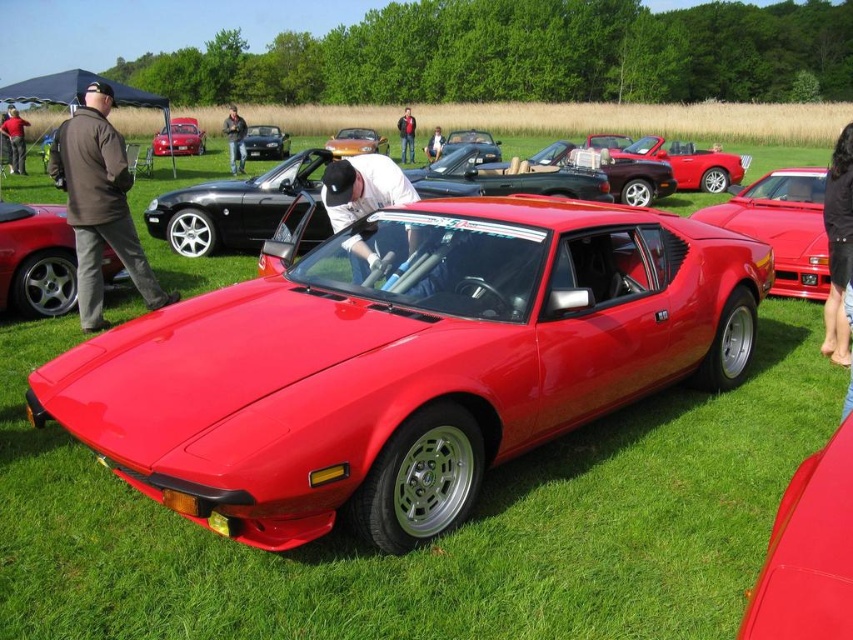
Question: Considering the relative positions of matte black car at left and matte black shirt at center in the image provided, where is matte black car at left located with respect to matte black shirt at center?

Choices:
 (A) right
 (B) left

Answer: (B)

Question: Which point is closer to the camera taking this photo?

Choices:
 (A) (18, 148)
 (B) (366, 145)

Answer: (A)

Question: Can you confirm if brown jacket at left is positioned to the left of denim jacket at center?

Choices:
 (A) no
 (B) yes

Answer: (B)

Question: Which point is closer to the camera?

Choices:
 (A) black leather pants at lower right
 (B) metallic red car at center

Answer: (A)

Question: Can you confirm if metallic red car at center is positioned to the left of denim pants at center?

Choices:
 (A) no
 (B) yes

Answer: (B)

Question: Which object is the farthest from the dark brown leather jacket at left?

Choices:
 (A) shiny red sports car at center
 (B) metallic orange convertible at center

Answer: (A)